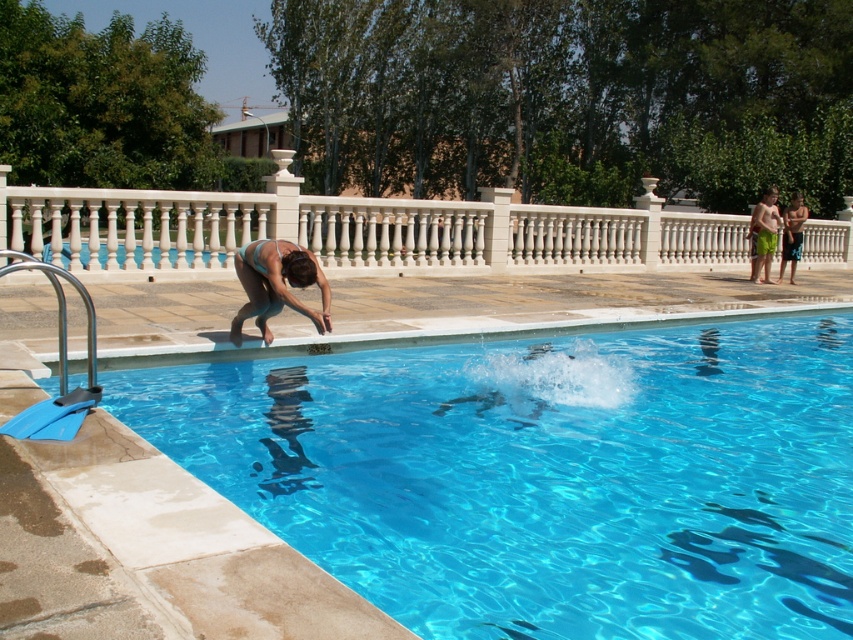
You are standing on the walkway and want to jump into the pool. Based on the image, where should you jump to land in the transparent blue water at center without hitting the blue shorts at right?

You should jump towards the transparent blue water at center since it is located below the blue shorts at right, meaning the water is positioned under the shorts, so jumping there would land you safely in the water without hitting the shorts.

You are standing on the walkway near the white marble railing at upper center and want to jump into the transparent blue water at center. Which direction should you move to reach the water?

You should move to the left to reach the transparent blue water at center since it is located to the left of the white marble railing at upper center.

You are standing at the edge of the pool and see the point marked at coordinates [149,552]. What is the surface you are standing on, and what is located at that point?

The surface you are standing on is the beige stone balustrade with balusters. The point at [149,552] is located on the transparent blue water at center.